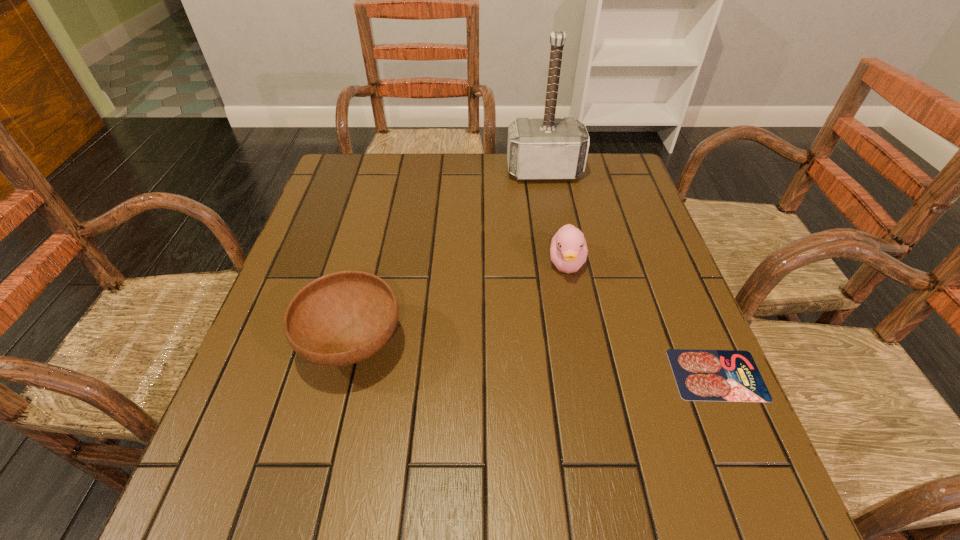
Find the location of a particular element. Image resolution: width=960 pixels, height=540 pixels. object present at the near right corner is located at coordinates (701, 375).

Image resolution: width=960 pixels, height=540 pixels. Find the location of `free location at the far edge`. free location at the far edge is located at coordinates (415, 176).

The width and height of the screenshot is (960, 540). I want to click on vacant space at the left edge, so click(x=344, y=235).

Where is `vacant space at the right edge of the desktop`? vacant space at the right edge of the desktop is located at coordinates (627, 248).

The width and height of the screenshot is (960, 540). I want to click on vacant region at the far left corner of the desktop, so click(x=353, y=159).

Identify the location of vacant area at the far right corner of the desktop. This screenshot has height=540, width=960. (615, 182).

Identify the location of vacant space at the near right corner. The width and height of the screenshot is (960, 540). (648, 417).

This screenshot has width=960, height=540. I want to click on free spot between the duckling and the tallest object, so click(x=555, y=218).

At what (x,y) coordinates should I click in order to perform the action: click on vacant space in between the second farthest object and the hammer. Please return your answer as a coordinate pair (x, y). This screenshot has height=540, width=960. Looking at the image, I should click on (555, 218).

In order to click on vacant area that lies between the bowl and the farthest object in this screenshot , I will do point(448,258).